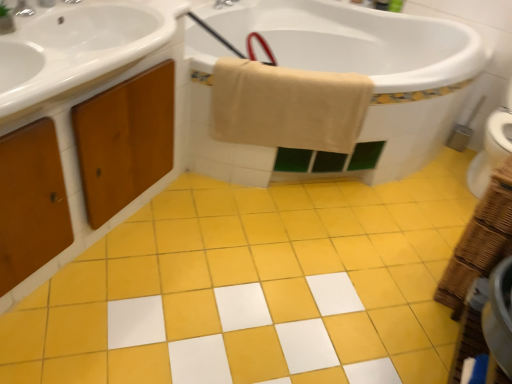
At what (x,y) coordinates should I click in order to perform the action: click on free space in front of metallic silver brush at right. Please return your answer as a coordinate pair (x, y). The height and width of the screenshot is (384, 512). Looking at the image, I should click on (457, 159).